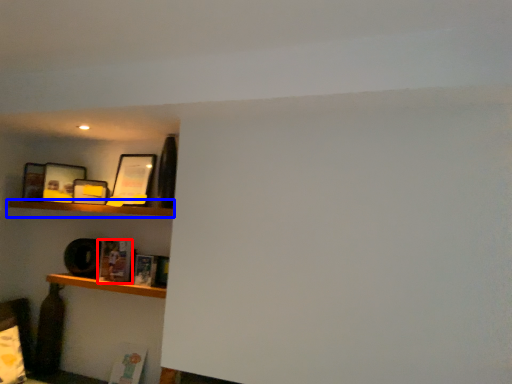
Question: Which object is closer to the camera taking this photo, book (highlighted by a red box) or shelf (highlighted by a blue box)?

Choices:
 (A) book
 (B) shelf

Answer: (B)